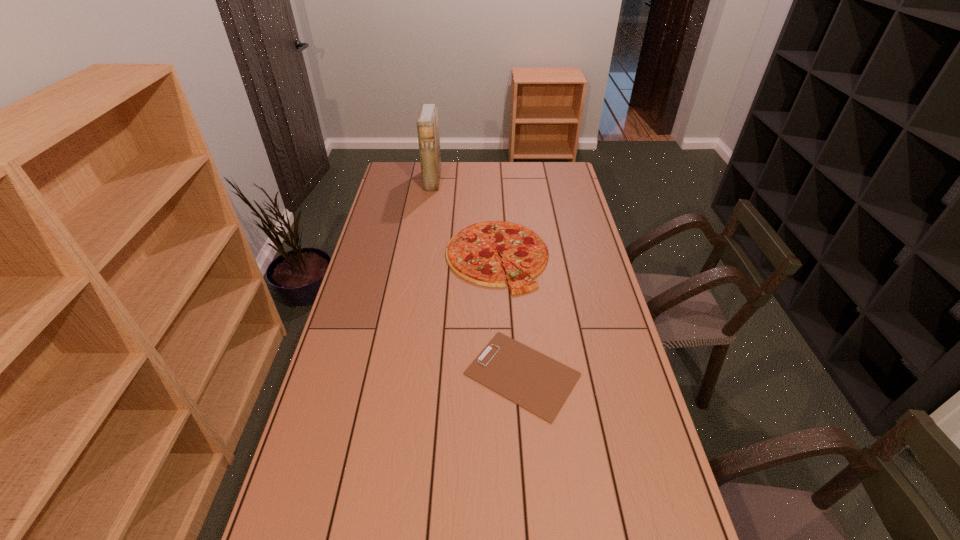
You are a GUI agent. You are given a task and a screenshot of the screen. Output one action in this format:
    pyautogui.click(x=<x>, y=<y>)
    Task: Click on the vacant space that satisfies the following two spatial constraints: 1. on the cover of the tallest object; 2. on the right side of the shortest object
    This screenshot has width=960, height=540.
    Given the screenshot: What is the action you would take?
    pyautogui.click(x=402, y=374)

The image size is (960, 540). In order to click on vacant space that satisfies the following two spatial constraints: 1. on the cover of the tallest object; 2. on the left side of the clipboard in this screenshot , I will do `click(402, 374)`.

Find the location of a particular element. vacant space that satisfies the following two spatial constraints: 1. on the cover of the tallest object; 2. on the left side of the nearest object is located at coordinates (402, 374).